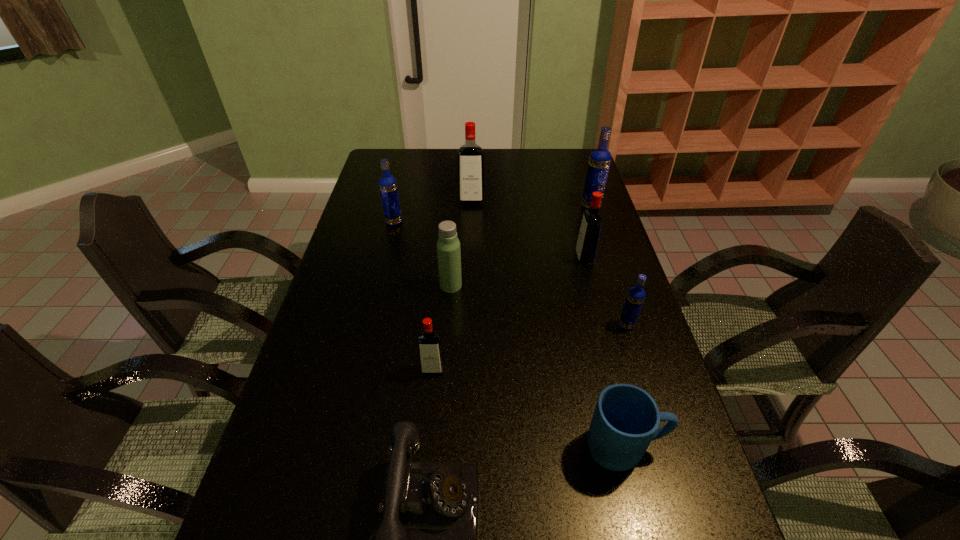
Identify the location of free space located 0.390m on the back of the thermos bottle. The height and width of the screenshot is (540, 960). (456, 206).

Find the location of `vacant space located 0.140m on the left of the second nearest vodka`. vacant space located 0.140m on the left of the second nearest vodka is located at coordinates (567, 325).

Where is `vacant space located 0.210m on the front and back of the smallest red vodka`? Image resolution: width=960 pixels, height=540 pixels. vacant space located 0.210m on the front and back of the smallest red vodka is located at coordinates (424, 460).

Image resolution: width=960 pixels, height=540 pixels. I want to click on object at the left edge, so click(x=388, y=186).

The height and width of the screenshot is (540, 960). Identify the location of mug that is positioned at the right edge. (626, 418).

Identify the location of free space at the far edge of the desktop. click(548, 168).

Where is `free space at the left edge of the desktop`? Image resolution: width=960 pixels, height=540 pixels. free space at the left edge of the desktop is located at coordinates tap(355, 397).

Locate an element on the screen. The image size is (960, 540). blank space at the right edge of the desktop is located at coordinates (644, 506).

Locate an element on the screen. This screenshot has width=960, height=540. vacant space that is in between the nearest red vodka and the sixth farthest object is located at coordinates (530, 347).

Find the location of `free space that is in between the biggest blue vodka and the leftmost red vodka`. free space that is in between the biggest blue vodka and the leftmost red vodka is located at coordinates (512, 288).